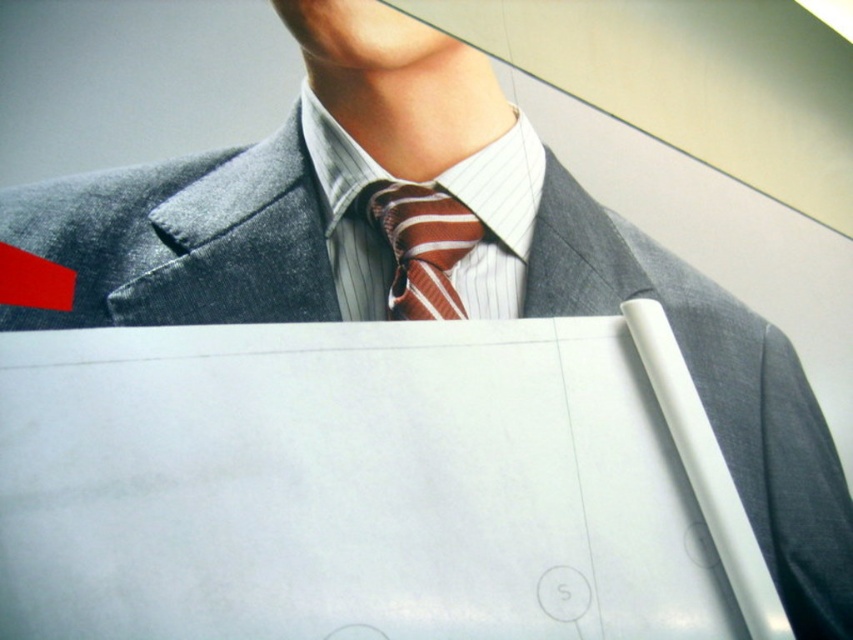
Is point (497, 532) more distant than point (462, 228)?

That is False.

You are a GUI agent. You are given a task and a screenshot of the screen. Output one action in this format:
    pyautogui.click(x=<x>, y=<y>)
    Task: Click on the white paper at center
    
    Given the screenshot: What is the action you would take?
    pos(369,484)